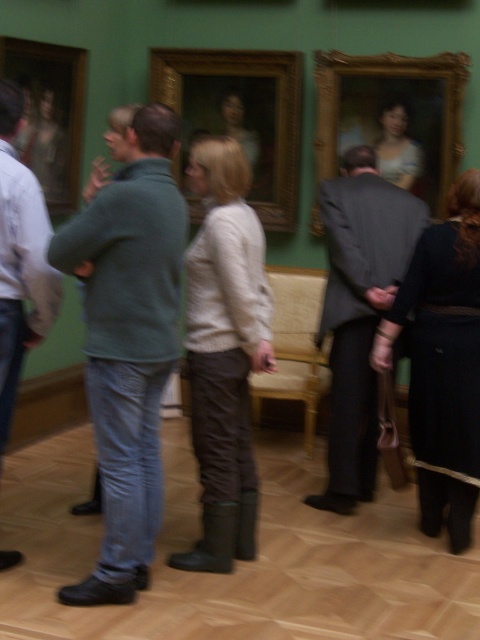
You are a tour guide standing at the entrance of the gallery. You notice a visitor wearing matte brown pants at center who is 9.10 feet away from you. Can you approach them without leaving the entrance area? The entrance area has a radius of 8 feet.

The matte brown pants at center and viewer are 9.10 feet apart from each other. Since the entrance area has a radius of 8 feet, the distance exceeds the allowed radius, so you cannot approach them without leaving the entrance area.

You are an interior designer planning to place a new sofa in the museum. You see the black leather dress at lower right and the wooden frame at left. Which object takes up more space in the room?

The black leather dress at lower right has a larger size compared to wooden frame at left, so it takes up more space in the room.

You are an interior designer planning to rearrange the gallery space. You need to move the black leather dress at lower right and the wooden framed portrait at center. Which object is located below the other?

The black leather dress at lower right is positioned under the wooden framed portrait at center, so the dress is below the portrait.